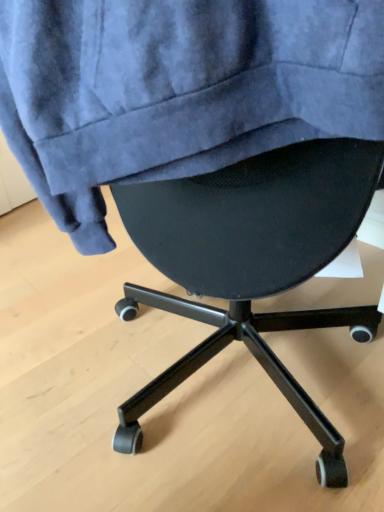
Question: Is black mesh chair at center positioned before velvet blue sweatshirt at upper center?

Choices:
 (A) yes
 (B) no

Answer: (B)

Question: Is black mesh chair at center looking in the opposite direction of velvet blue sweatshirt at upper center?

Choices:
 (A) yes
 (B) no

Answer: (B)

Question: Considering the relative sizes of black mesh chair at center and velvet blue sweatshirt at upper center in the image provided, is black mesh chair at center wider than velvet blue sweatshirt at upper center?

Choices:
 (A) no
 (B) yes

Answer: (B)

Question: Can you confirm if black mesh chair at center is positioned to the right of velvet blue sweatshirt at upper center?

Choices:
 (A) yes
 (B) no

Answer: (B)

Question: From a real-world perspective, is black mesh chair at center physically below velvet blue sweatshirt at upper center?

Choices:
 (A) yes
 (B) no

Answer: (A)

Question: Could velvet blue sweatshirt at upper center be considered to be inside black mesh chair at center?

Choices:
 (A) no
 (B) yes

Answer: (A)

Question: Is velvet blue sweatshirt at upper center outside black mesh chair at center?

Choices:
 (A) no
 (B) yes

Answer: (B)

Question: Would you say velvet blue sweatshirt at upper center contains black mesh chair at center?

Choices:
 (A) yes
 (B) no

Answer: (B)

Question: Does velvet blue sweatshirt at upper center appear on the left side of black mesh chair at center?

Choices:
 (A) yes
 (B) no

Answer: (B)

Question: Is velvet blue sweatshirt at upper center smaller than black mesh chair at center?

Choices:
 (A) no
 (B) yes

Answer: (A)

Question: Is there a large distance between velvet blue sweatshirt at upper center and black mesh chair at center?

Choices:
 (A) yes
 (B) no

Answer: (B)

Question: From a real-world perspective, is velvet blue sweatshirt at upper center over black mesh chair at center?

Choices:
 (A) no
 (B) yes

Answer: (B)

Question: Considering the positions of black mesh chair at center and velvet blue sweatshirt at upper center in the image, is black mesh chair at center bigger or smaller than velvet blue sweatshirt at upper center?

Choices:
 (A) small
 (B) big

Answer: (A)